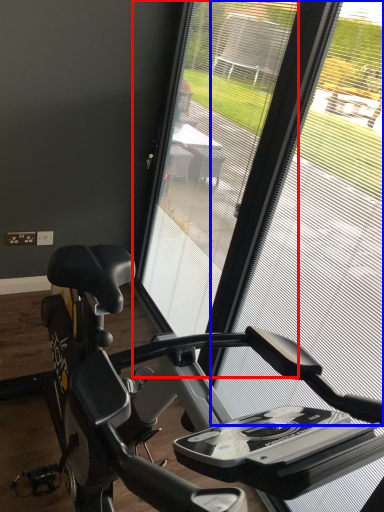
Question: Among these objects, which one is farthest to the camera, screen door (highlighted by a red box) or window screen (highlighted by a blue box)?

Choices:
 (A) screen door
 (B) window screen

Answer: (A)